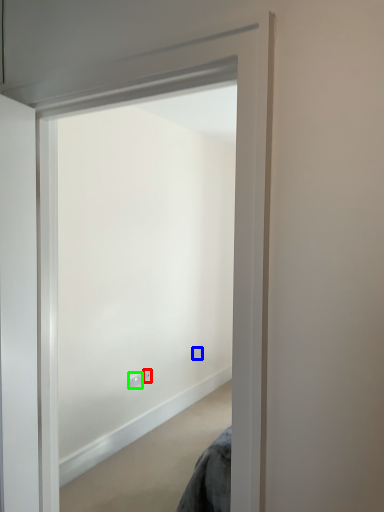
Question: Which is farther away from electric outlet (highlighted by a red box)? electric outlet (highlighted by a blue box) or electric outlet (highlighted by a green box)?

Choices:
 (A) electric outlet
 (B) electric outlet

Answer: (A)